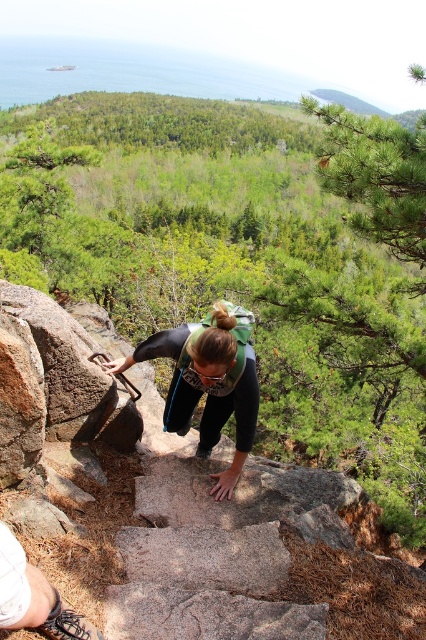
The hiker is trying to navigate the granite steps at center. Given their position, which direction should they move to reach the top of the staircase?

The granite steps at center are located at point coordinates, but without specific directional context, the hiker should follow the natural ascending path of the staircase towards higher elevation.

You are a hiker looking to place a small first aid kit on the nearest available surface. You have the granite steps at center and the matte black pants at center in your view. Which surface should you choose to place it?

The granite steps at center is located below matte black pants at center, so you should place the first aid kit on the granite steps at center since it is a stable surface below your current position.